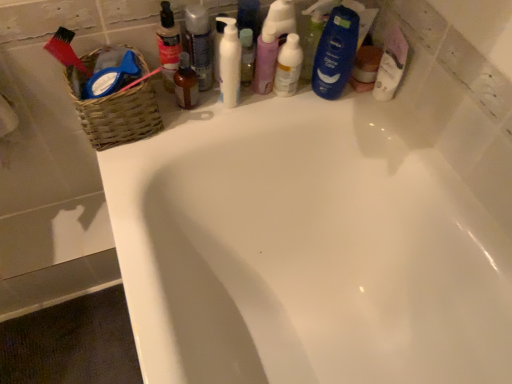
Where is `free space in front of white matte pump bottle at upper center`? This screenshot has width=512, height=384. free space in front of white matte pump bottle at upper center is located at coordinates (200, 133).